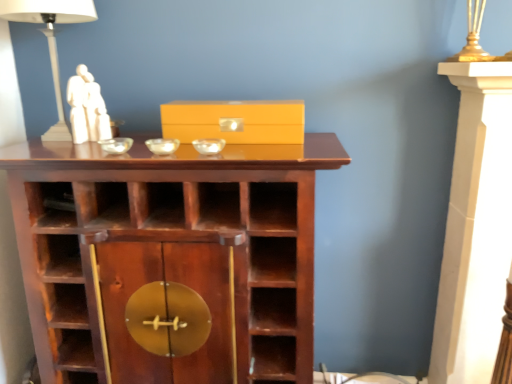
Question: Considering the positions of white marble statue at upper left and brown wood shelf at center in the image, is white marble statue at upper left taller or shorter than brown wood shelf at center?

Choices:
 (A) short
 (B) tall

Answer: (A)

Question: Would you say white marble statue at upper left is to the left or to the right of brown wood shelf at center in the picture?

Choices:
 (A) right
 (B) left

Answer: (B)

Question: Which object is the farthest from the clear glass bowl at center, acting as the third glass bowl starting from the right?

Choices:
 (A) transparent glass bowl at center, which is the 2th glass bowl in right-to-left order
 (B) brown wood shelf at center
 (C) white marble statue at upper left
 (D) matte yellow box at center
 (E) white ceramic table lamp at upper left

Answer: (B)

Question: Considering the real-world distances, which object is closest to the matte yellow box at center?

Choices:
 (A) transparent glass bowl at center, which appears as the second glass bowl when viewed from the left
 (B) clear glass bowl at center, acting as the third glass bowl starting from the right
 (C) transparent glass bowl at center, the third glass bowl in the left-to-right sequence
 (D) white ceramic table lamp at upper left
 (E) brown wood shelf at center

Answer: (C)